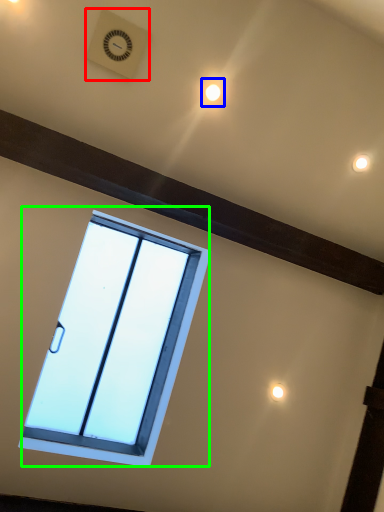
Question: Considering the real-world distances, which object is farthest from clock (highlighted by a red box)? light (highlighted by a blue box) or window (highlighted by a green box)?

Choices:
 (A) light
 (B) window

Answer: (B)